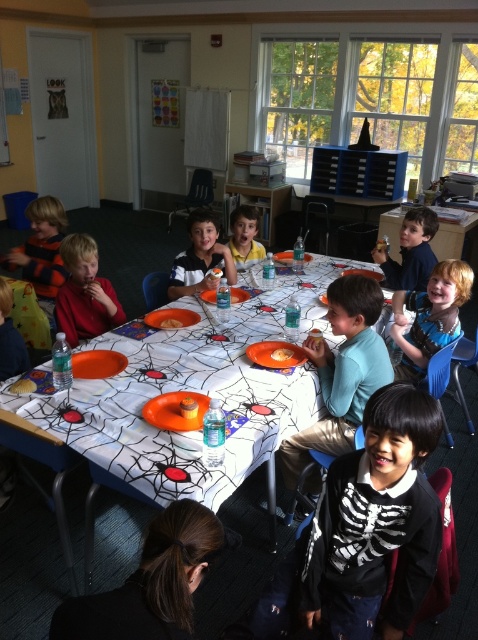
Question: Is black hair at lower center positioned at the back of matte red shirt at center?

Choices:
 (A) no
 (B) yes

Answer: (A)

Question: Which of the following is the closest to the observer?

Choices:
 (A) (79, 336)
 (B) (253, 248)
 (C) (288, 349)
 (D) (412, 451)

Answer: (D)

Question: Which object is farther from the camera taking this photo?

Choices:
 (A) black matte skeleton costume at center
 (B) translucent plastic cup at center
 (C) orange plastic plate at center
 (D) white paper table at center

Answer: (C)

Question: In this image, where is matte red shirt at center located relative to matte yellow shirt at center?

Choices:
 (A) right
 (B) left

Answer: (B)

Question: Is white paper table at center further to the viewer compared to black hair at lower center?

Choices:
 (A) yes
 (B) no

Answer: (A)

Question: Which of these objects is positioned farthest from the matte plastic cup at center?

Choices:
 (A) black matte skeleton costume at center
 (B) matte blue shirt at upper center
 (C) black hair at lower center

Answer: (C)